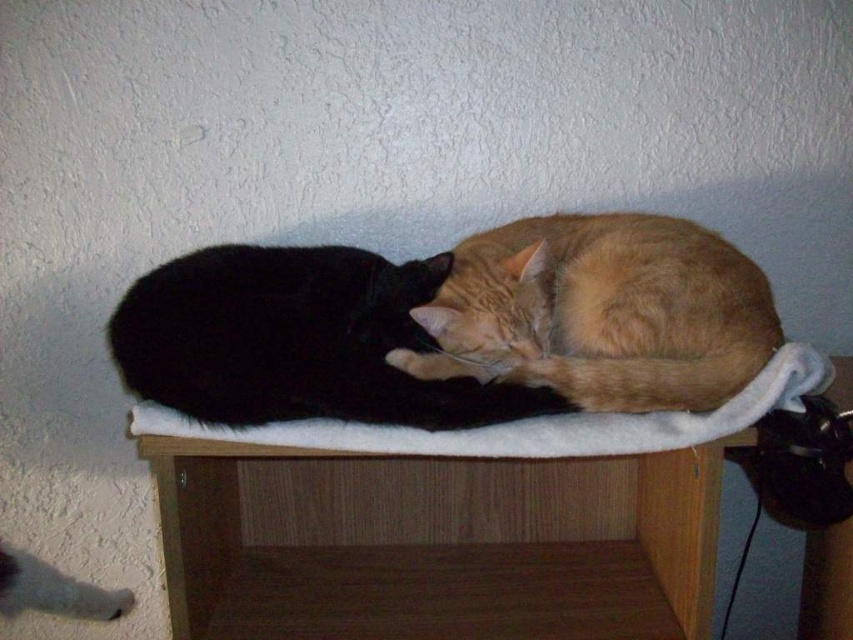
Question: Estimate the real-world distances between objects in this image. Which object is farther from the orange fur cat at center?

Choices:
 (A) white soft cat bed at center
 (B) black fur cat at center

Answer: (B)

Question: Which object is positioned closest to the white soft cat bed at center?

Choices:
 (A) orange fur cat at center
 (B) black fur cat at center

Answer: (B)

Question: Which of the following is the farthest from the observer?

Choices:
 (A) (753, 314)
 (B) (653, 433)
 (C) (257, 333)

Answer: (A)

Question: Observing the image, what is the correct spatial positioning of orange fur cat at center in reference to white soft cat bed at center?

Choices:
 (A) right
 (B) left

Answer: (A)

Question: Is orange fur cat at center thinner than white soft cat bed at center?

Choices:
 (A) yes
 (B) no

Answer: (A)

Question: Can you confirm if orange fur cat at center is positioned to the left of black fur cat at center?

Choices:
 (A) yes
 (B) no

Answer: (B)